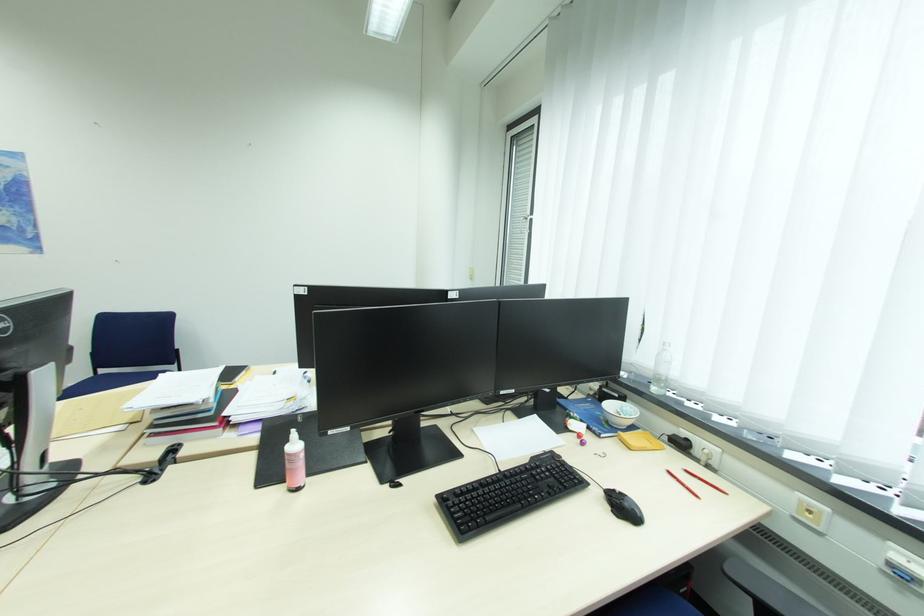
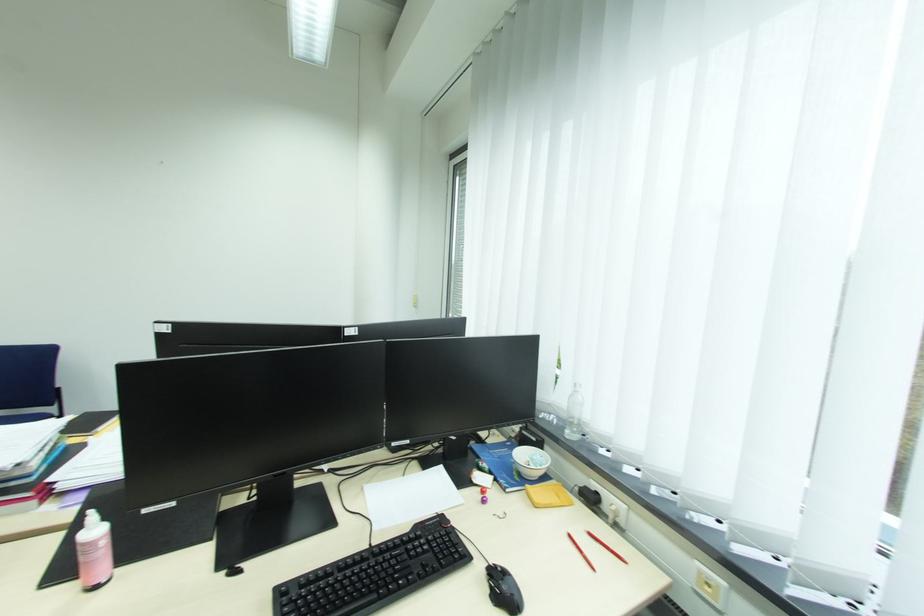
Question: How did the camera likely rotate?

Choices:
 (A) Left
 (B) Right
 (C) Up
 (D) Down

Answer: (B)